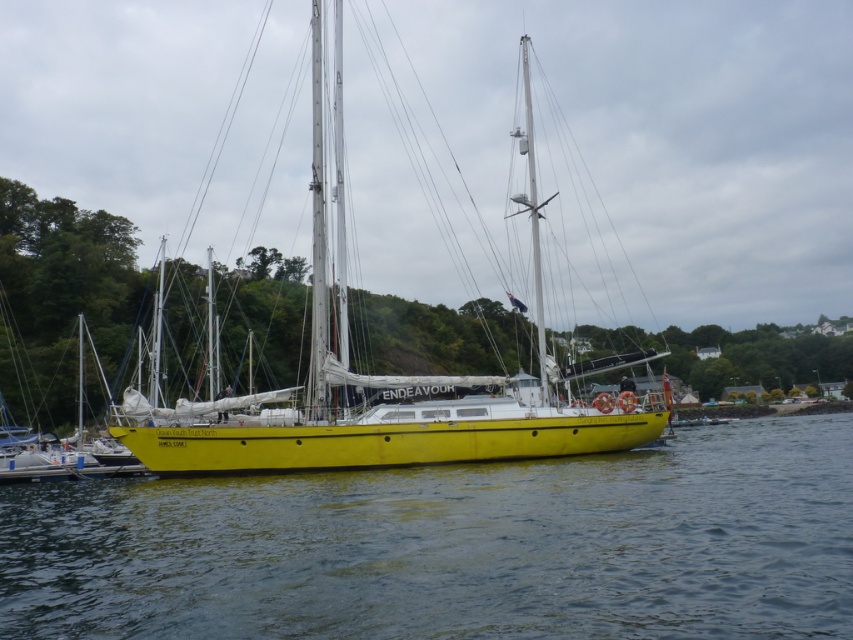
Question: Does yellow matte water at center have a smaller size compared to yellow matte sailboat at center?

Choices:
 (A) yes
 (B) no

Answer: (A)

Question: Where is yellow matte water at center located in relation to yellow matte sailboat at center in the image?

Choices:
 (A) above
 (B) below

Answer: (B)

Question: Does yellow matte water at center appear on the left side of yellow matte sailboat at center?

Choices:
 (A) yes
 (B) no

Answer: (B)

Question: Which point is farther from the camera taking this photo?

Choices:
 (A) (387, 544)
 (B) (318, 188)

Answer: (B)

Question: Which of the following is the farthest from the observer?

Choices:
 (A) yellow matte sailboat at center
 (B) yellow matte water at center

Answer: (A)